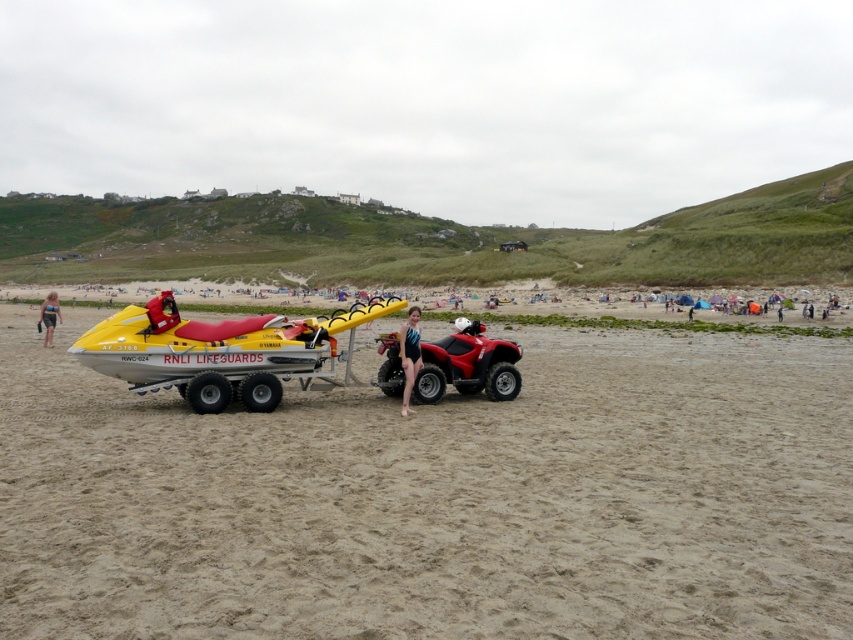
You are a photographer trying to capture a shot of the sandy beige at center and the matte red quad bike at center. Which object should you focus on first if you want to include both in your frame without adjusting your camera settings?

The sandy beige at center has a greater height compared to the matte red quad bike at center, so you should focus on the sandy beige at center first to ensure both are in focus since it is taller and might require a different focal plane.